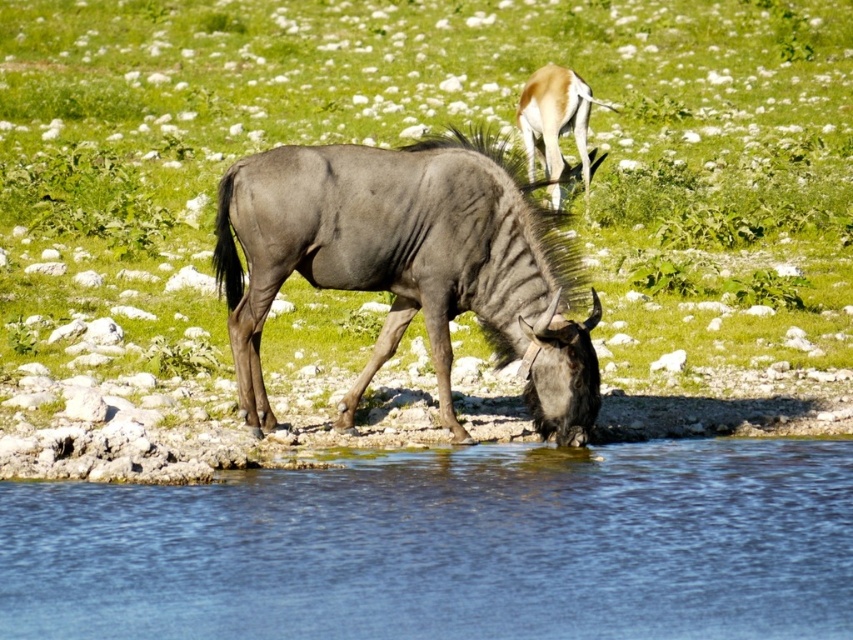
You are standing at the point marked by the coordinates point (448, 547) in the scene. Based on the description, what is the terrain type under your feet?

The terrain under your feet at point (448, 547) is transparent blue water at lower center, as the point is described to be on transparent blue water at lower center.